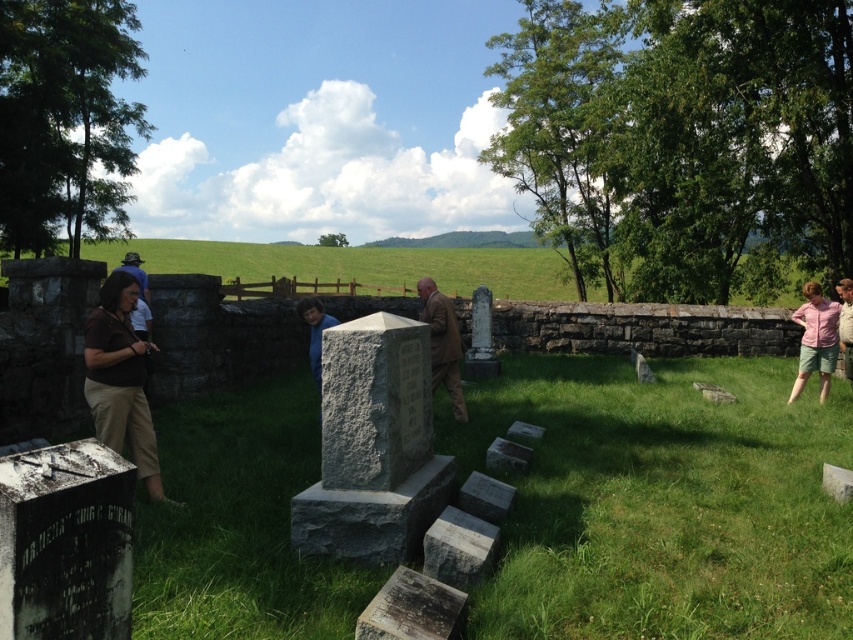
Can you confirm if green grassy field at center is thinner than brown wool coat at center?

In fact, green grassy field at center might be wider than brown wool coat at center.

Is green grassy field at center wider than brown wool coat at center?

Indeed, green grassy field at center has a greater width compared to brown wool coat at center.

Identify the location of green grassy field at center. (357, 264).

Image resolution: width=853 pixels, height=640 pixels. What are the coordinates of `green grassy field at center` in the screenshot? It's located at (357, 264).

Which is more to the left, pink cotton shirt at right or brown wool coat at center?

Positioned to the left is brown wool coat at center.

Can you confirm if pink cotton shirt at right is taller than brown wool coat at center?

Incorrect, pink cotton shirt at right's height is not larger of brown wool coat at center's.

Is point (811, 340) behind point (451, 396)?

Yes, it is behind point (451, 396).

Where is `pink cotton shirt at right`? Image resolution: width=853 pixels, height=640 pixels. pink cotton shirt at right is located at coordinates (816, 339).

Between green grassy field at center and pink cotton shirt at right, which one appears on the left side from the viewer's perspective?

Positioned to the left is green grassy field at center.

Who is higher up, green grassy field at center or pink cotton shirt at right?

green grassy field at center

Does point (413, 262) come farther from viewer compared to point (807, 324)?

That is True.

Find the location of a particular element. Image resolution: width=853 pixels, height=640 pixels. green grassy field at center is located at coordinates (357, 264).